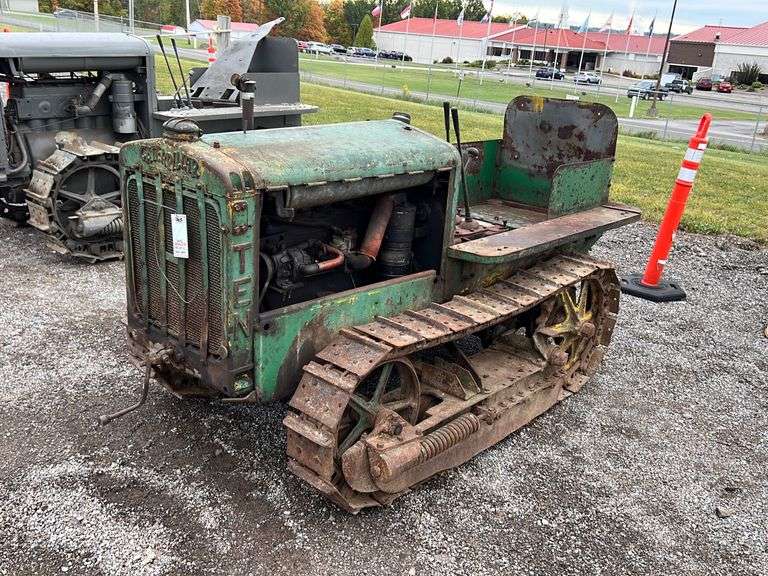
I want to click on radiator, so click(x=194, y=282).